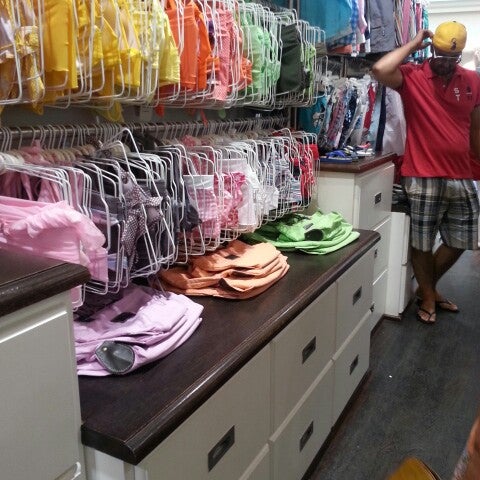
Identify the location of floor. This screenshot has width=480, height=480. (421, 405).